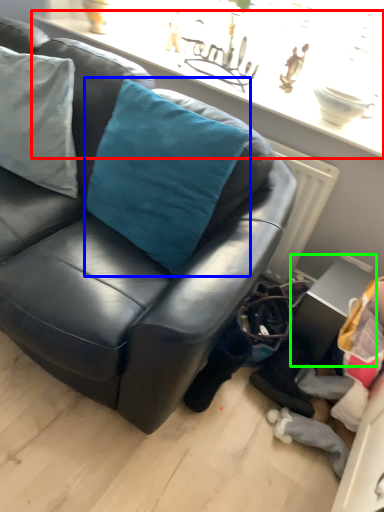
Question: Which object is positioned farthest from window sill (highlighted by a red box)? Select from throw pillow (highlighted by a blue box) and table (highlighted by a green box).

Choices:
 (A) throw pillow
 (B) table

Answer: (B)